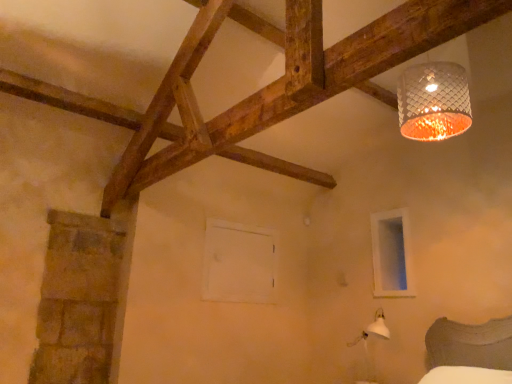
Question: Considering the relative sizes of white matte window frame at center, which ranks as the 1th window frame in left-to-right order, and white matte window frame at lower right, which is the second window frame from left to right, in the image provided, is white matte window frame at center, which ranks as the 1th window frame in left-to-right order, bigger than white matte window frame at lower right, which is the second window frame from left to right,?

Choices:
 (A) yes
 (B) no

Answer: (A)

Question: Does white matte window frame at center, the second window frame from the right, have a greater height compared to white matte window frame at lower right, which is the second window frame from left to right?

Choices:
 (A) no
 (B) yes

Answer: (A)

Question: Can you confirm if white matte window frame at center, the second window frame from the right, is positioned to the left of white matte window frame at lower right, which appears as the 1th window frame when viewed from the right?

Choices:
 (A) no
 (B) yes

Answer: (B)

Question: Does white matte window frame at center, the second window frame from the right, have a lesser height compared to white matte window frame at lower right, which is the second window frame from left to right?

Choices:
 (A) no
 (B) yes

Answer: (B)

Question: From a real-world perspective, is white matte window frame at center, the second window frame from the right, physically below white matte window frame at lower right, which appears as the 1th window frame when viewed from the right?

Choices:
 (A) no
 (B) yes

Answer: (B)

Question: From the image's perspective, is white matte window frame at center, the second window frame from the right, over white matte window frame at lower right, which is the second window frame from left to right?

Choices:
 (A) yes
 (B) no

Answer: (B)

Question: Could you tell me if white matte window frame at lower right, which is the second window frame from left to right, is facing white matte window frame at center, which ranks as the 1th window frame in left-to-right order?

Choices:
 (A) no
 (B) yes

Answer: (A)

Question: Is white matte window frame at lower right, which appears as the 1th window frame when viewed from the right, in front of white matte window frame at center, which ranks as the 1th window frame in left-to-right order?

Choices:
 (A) no
 (B) yes

Answer: (B)

Question: Does white matte window frame at lower right, which is the second window frame from left to right, come behind white matte window frame at center, the second window frame from the right?

Choices:
 (A) no
 (B) yes

Answer: (A)

Question: Is white matte window frame at lower right, which appears as the 1th window frame when viewed from the right, not inside white matte window frame at center, the second window frame from the right?

Choices:
 (A) yes
 (B) no

Answer: (A)

Question: Is white matte window frame at lower right, which appears as the 1th window frame when viewed from the right, oriented away from white matte window frame at center, which ranks as the 1th window frame in left-to-right order?

Choices:
 (A) yes
 (B) no

Answer: (B)

Question: Considering the relative sizes of white matte window frame at lower right, which appears as the 1th window frame when viewed from the right, and white matte window frame at center, which ranks as the 1th window frame in left-to-right order, in the image provided, is white matte window frame at lower right, which appears as the 1th window frame when viewed from the right, thinner than white matte window frame at center, which ranks as the 1th window frame in left-to-right order,?

Choices:
 (A) yes
 (B) no

Answer: (A)

Question: Looking at their shapes, would you say white matte window frame at center, the second window frame from the right, is wider or thinner than white matte window frame at lower right, which appears as the 1th window frame when viewed from the right?

Choices:
 (A) wide
 (B) thin

Answer: (A)